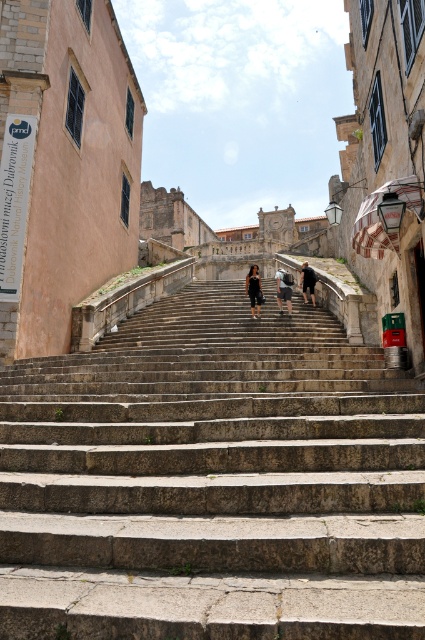
Question: Is dark blue jeans at center thinner than dark gray stone stairs at center?

Choices:
 (A) no
 (B) yes

Answer: (B)

Question: Is stone steps at center above dark blue jeans at center?

Choices:
 (A) yes
 (B) no

Answer: (B)

Question: Which of these objects is positioned farthest from the dark gray stone figure at center?

Choices:
 (A) stone steps at center
 (B) dark gray stone stairs at center

Answer: (A)

Question: Among these points, which one is farthest from the camera?

Choices:
 (A) (249, 296)
 (B) (286, 294)
 (C) (306, 296)

Answer: (C)

Question: Can you confirm if stone steps at center is thinner than dark gray stone stairs at center?

Choices:
 (A) yes
 (B) no

Answer: (B)

Question: Which is nearer to the dark gray stone stairs at center?

Choices:
 (A) dark gray stone figure at center
 (B) stone steps at center

Answer: (A)